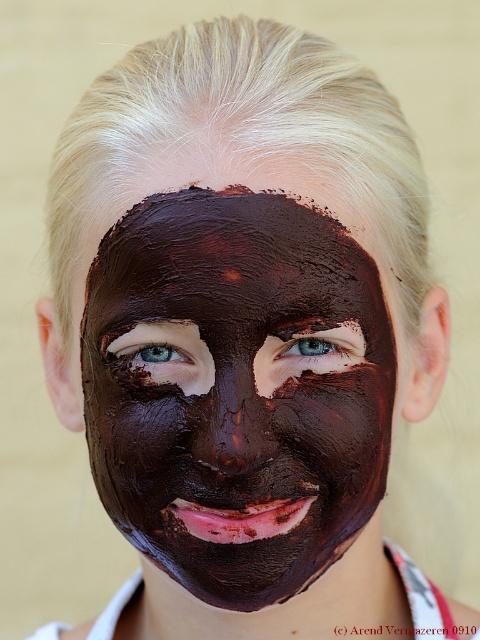
Question: Does matte chocolate mask at center have a lesser width compared to brown matte eye at center?

Choices:
 (A) no
 (B) yes

Answer: (A)

Question: Which point is farther to the camera?

Choices:
 (A) matte chocolate mask at center
 (B) brown matte eye at center

Answer: (B)

Question: Does matte chocolate mask at center appear on the left side of blue matte eye at center?

Choices:
 (A) no
 (B) yes

Answer: (A)

Question: Which point appears closest to the camera in this image?

Choices:
 (A) (361, 342)
 (B) (184, 417)

Answer: (B)

Question: From the image, what is the correct spatial relationship of matte chocolate mask at center in relation to brown matte eye at center?

Choices:
 (A) left
 (B) right

Answer: (A)

Question: Which point is closer to the camera?

Choices:
 (A) brown matte eye at center
 (B) blue matte eye at center
 (C) matte chocolate mask at center

Answer: (C)